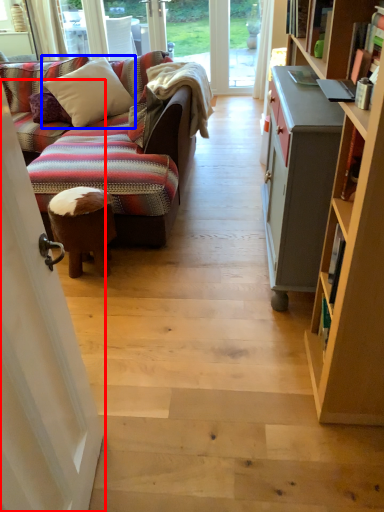
Question: Among these objects, which one is nearest to the camera, screen door (highlighted by a red box) or pillow (highlighted by a blue box)?

Choices:
 (A) screen door
 (B) pillow

Answer: (A)